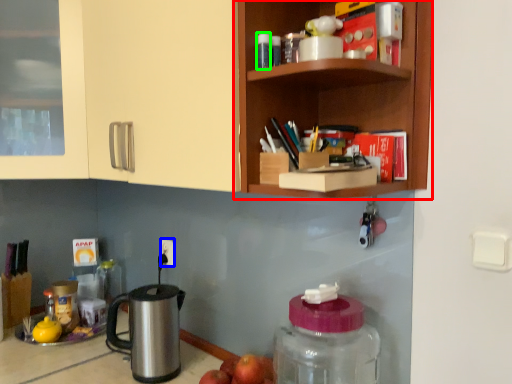
Question: Which object is positioned closest to shelf (highlighted by a red box)? Select from electric outlet (highlighted by a blue box) and bottle (highlighted by a green box).

Choices:
 (A) electric outlet
 (B) bottle

Answer: (B)